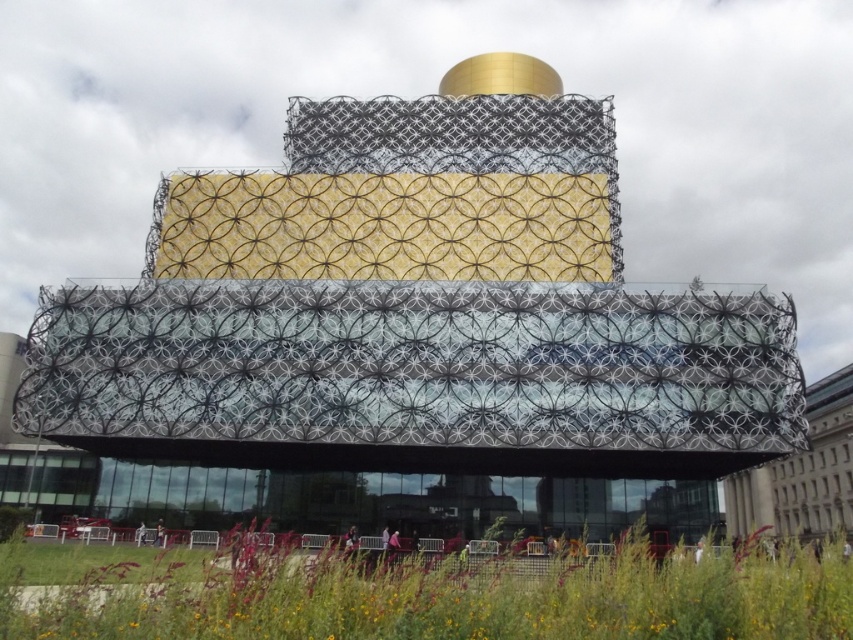
Question: Which of the following is the farthest from the observer?

Choices:
 (A) (764, 376)
 (B) (838, 625)

Answer: (A)

Question: Which object appears farthest from the camera in this image?

Choices:
 (A) translucent glass facade at center
 (B) green grass at lower center

Answer: (A)

Question: Which object appears farthest from the camera in this image?

Choices:
 (A) green grass at lower center
 (B) translucent glass facade at center

Answer: (B)

Question: Is translucent glass facade at center wider than green grass at lower center?

Choices:
 (A) no
 (B) yes

Answer: (B)

Question: Is the position of translucent glass facade at center more distant than that of green grass at lower center?

Choices:
 (A) no
 (B) yes

Answer: (B)

Question: Can you confirm if translucent glass facade at center is positioned below green grass at lower center?

Choices:
 (A) no
 (B) yes

Answer: (A)